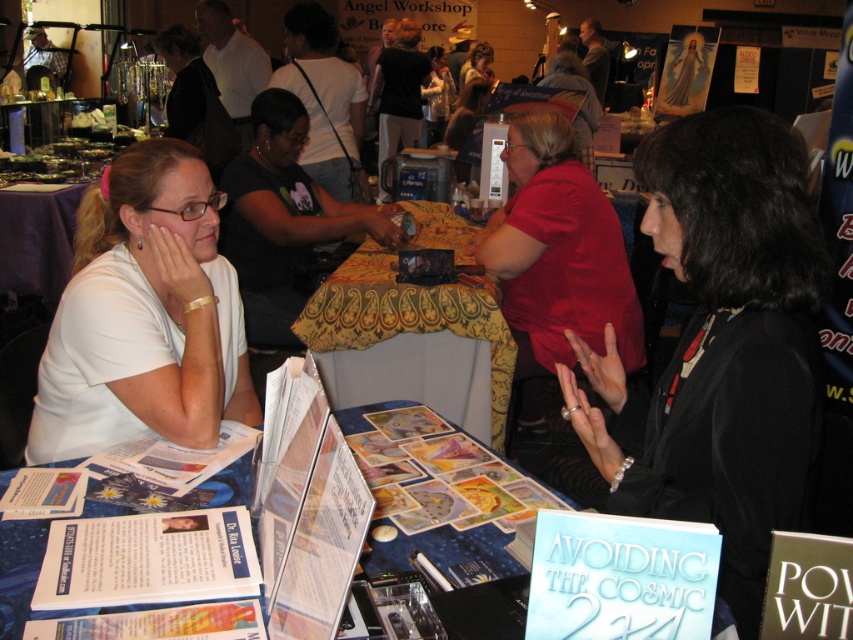
Is point (281, 186) positioned in front of point (331, 307)?

No, (281, 186) is behind (331, 307).

You are a GUI agent. You are given a task and a screenshot of the screen. Output one action in this format:
    pyautogui.click(x=<x>, y=<y>)
    Task: Click on the black matte shirt at center
    
    Given the screenshot: What is the action you would take?
    pyautogui.click(x=283, y=220)

I want to click on white matte shirt at left, so click(x=144, y=316).

Does white matte shirt at left have a smaller size compared to blue fabric table at center?

Indeed, white matte shirt at left has a smaller size compared to blue fabric table at center.

Between point (123, 216) and point (239, 477), which one is positioned in front?

Point (239, 477)

At what (x,y) coordinates should I click in order to perform the action: click on white matte shirt at left. Please return your answer as a coordinate pair (x, y). The width and height of the screenshot is (853, 640). Looking at the image, I should click on (144, 316).

Does black leather jacket at right appear on the left side of blue fabric table at center?

In fact, black leather jacket at right is to the right of blue fabric table at center.

How far apart are black leather jacket at right and blue fabric table at center?

The distance of black leather jacket at right from blue fabric table at center is 14.58 inches.

Locate an element on the screen. The width and height of the screenshot is (853, 640). black leather jacket at right is located at coordinates (720, 346).